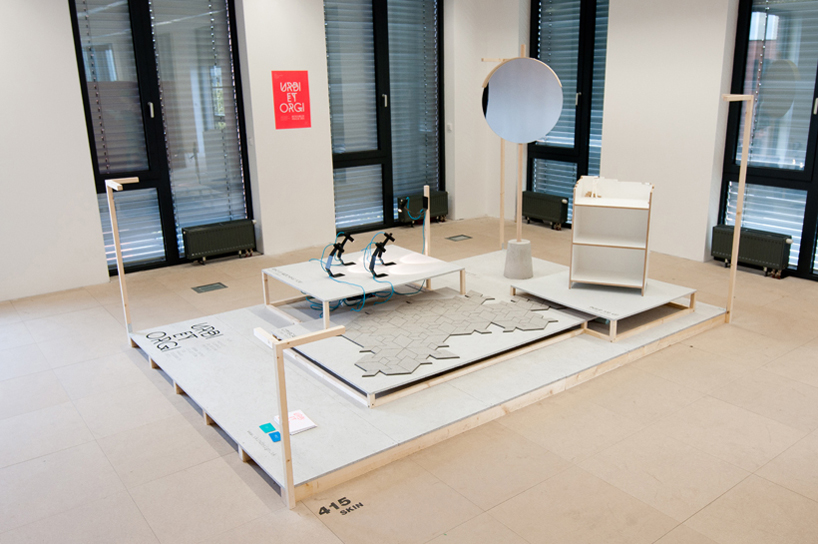
You are a GUI agent. You are given a task and a screenshot of the screen. Output one action in this format:
    pyautogui.click(x=<x>, y=<y>)
    Task: Click on the empty space on shorter table
    The height and width of the screenshot is (544, 818).
    Given the screenshot: What is the action you would take?
    pyautogui.click(x=617, y=313)